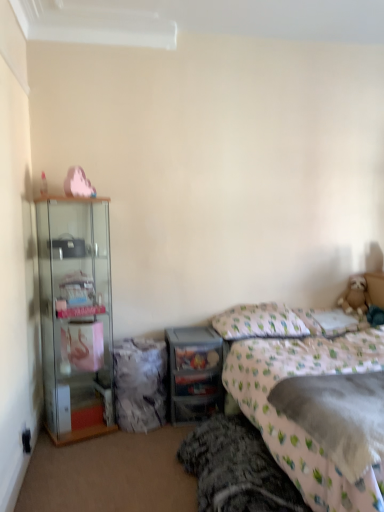
Where is `vacant area in front of clear glass cabinet at left`? vacant area in front of clear glass cabinet at left is located at coordinates point(76,459).